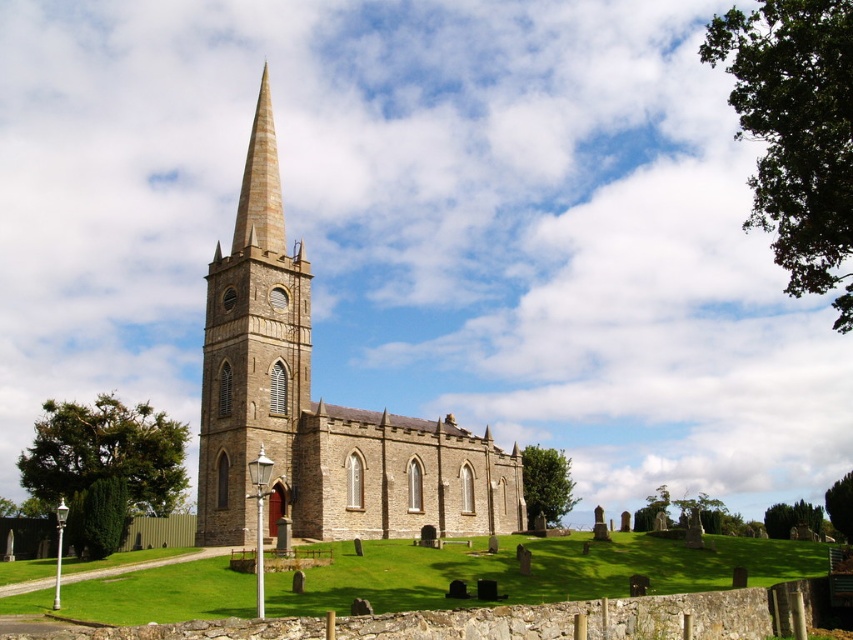
You are standing in front of the historic stone church and notice two structures at the center. The first is the brown stone steeple at center, and the second is the yellow striped stone spire at center. Which of these two structures is positioned higher up?

The yellow striped stone spire at center is positioned higher up since the brown stone steeple at center is located below it.

You are standing in front of the brown stone church at center and the yellow striped stone spire at center. Which structure is closer to you?

Result: The brown stone church at center is closer to you because it is in front of the yellow striped stone spire at center.